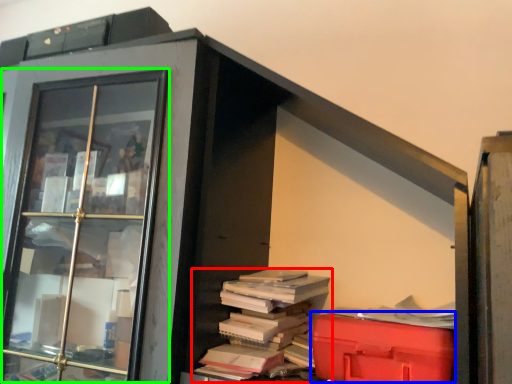
Question: Based on their relative distances, which object is nearer to book (highlighted by a red box)? Choose from waste (highlighted by a blue box) and glass door (highlighted by a green box).

Choices:
 (A) waste
 (B) glass door

Answer: (A)